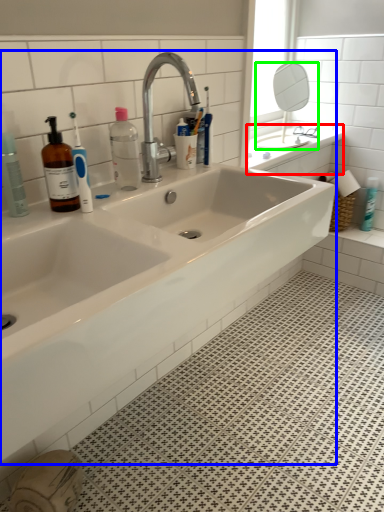
Question: Which object is the closest to the counter top (highlighted by a red box)? Choose among these: sink (highlighted by a blue box) or mirror (highlighted by a green box).

Choices:
 (A) sink
 (B) mirror

Answer: (B)